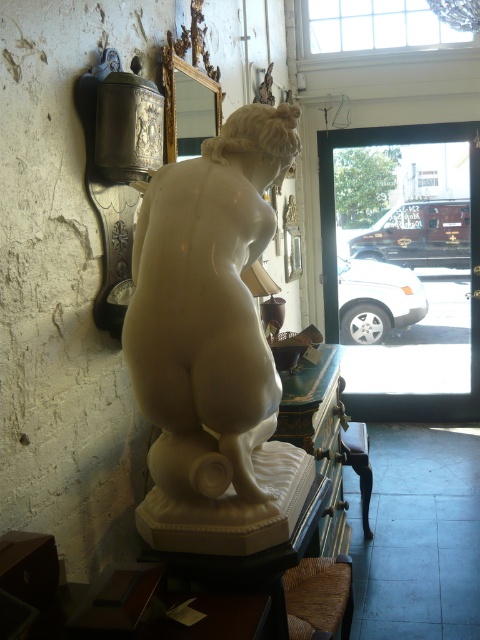
Consider the image. You are a visitor in the shop and want to sit down. There are two stools available, the brown woven stool at lower center and the wooden stool at lower center. If you want to sit as close as possible to the marble statue, which stool should you choose?

The brown woven stool at lower center is 1.26 meters away from the wooden stool at lower center. To sit as close as possible to the marble statue, you should choose the brown woven stool at lower center because it is positioned closer to the statue compared to the wooden stool at lower center.

You are a tour guide standing in the gallery and want to point out the white marble statue at left to your visitors. If you extend your arm fully, which is 0.7 meters long, can you comfortably touch the statue with your outstretched hand?

The white marble statue at left is 1.40 meters away from the viewer. Since your arm is 0.7 meters long, you cannot reach it comfortably with your outstretched hand as the distance is twice the length of your arm.

You are standing in the shop and want to locate the white marble statue at left. According to the coordinates provided, where should you look?

You should look at point (213,346) to find the white marble statue at left.